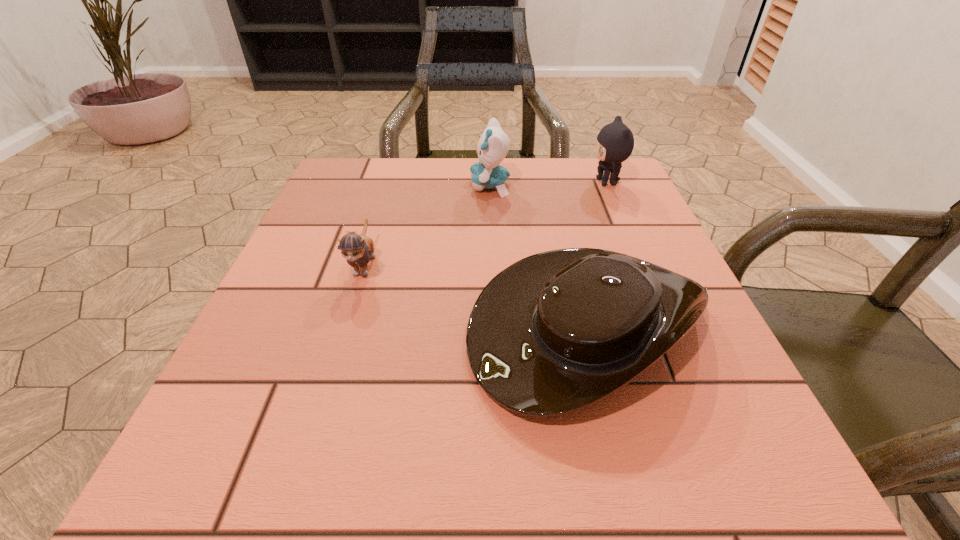
Find the location of `the second kitten from left to right`. the second kitten from left to right is located at coordinates (493, 146).

The height and width of the screenshot is (540, 960). I want to click on the rightmost kitten, so click(x=615, y=142).

I want to click on the leftmost object, so click(x=358, y=249).

Find the location of a particular element. the nearest kitten is located at coordinates (358, 249).

Where is `cowboy hat`? Image resolution: width=960 pixels, height=540 pixels. cowboy hat is located at coordinates (555, 332).

The width and height of the screenshot is (960, 540). Identify the location of vacant region located 0.120m on the face of the second kitten from right to left. (419, 186).

The image size is (960, 540). What are the coordinates of `free space located 0.200m on the face of the second kitten from right to left` in the screenshot? It's located at (384, 186).

Find the location of a particular element. Image resolution: width=960 pixels, height=540 pixels. vacant area located 0.290m on the face of the second kitten from right to left is located at coordinates (346, 186).

The height and width of the screenshot is (540, 960). In order to click on vacant region located 0.370m on the front-facing side of the rightmost kitten in this screenshot , I will do `click(433, 182)`.

Where is `vacant space positioned on the front-facing side of the rightmost kitten`? vacant space positioned on the front-facing side of the rightmost kitten is located at coordinates (492, 182).